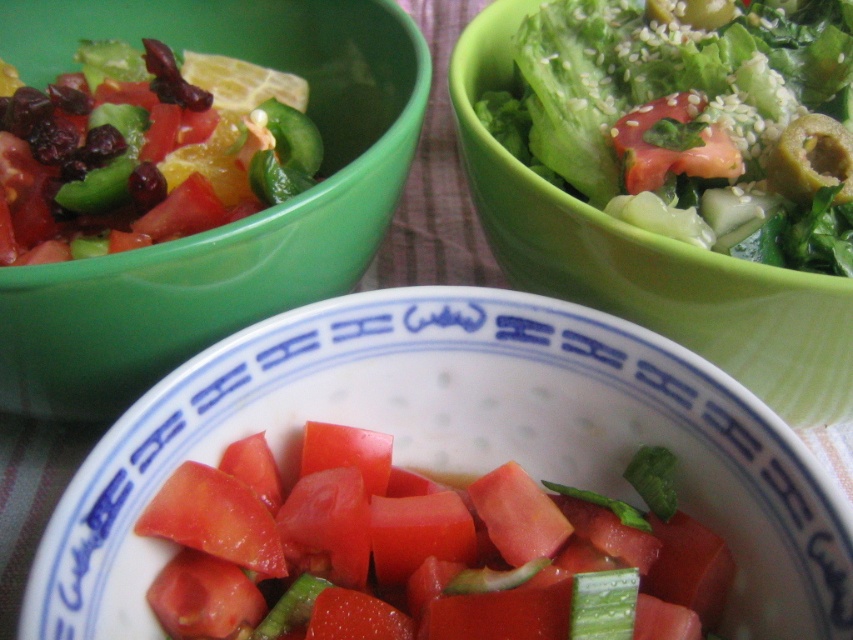
Question: Does shiny green salad at upper left have a larger size compared to slightly glossy red tomato at center?

Choices:
 (A) yes
 (B) no

Answer: (A)

Question: Which point is farther from the camera taking this photo?

Choices:
 (A) (244, 572)
 (B) (614, 150)
 (C) (30, 237)
 (D) (428, 371)

Answer: (B)

Question: Which is farther from the shiny green salad at upper left?

Choices:
 (A) green sesame seed salad at upper right
 (B) slightly glossy red tomato at center

Answer: (B)

Question: Does shiny green salad at upper left have a lesser width compared to slightly glossy red tomato at center?

Choices:
 (A) yes
 (B) no

Answer: (B)

Question: Which of the following is the farthest from the observer?

Choices:
 (A) (776, 449)
 (B) (425, 580)
 (C) (80, 316)
 (D) (657, 108)

Answer: (D)

Question: From the image, what is the correct spatial relationship of bright red tomato at center in relation to white glossy bowl at center?

Choices:
 (A) above
 (B) below

Answer: (B)